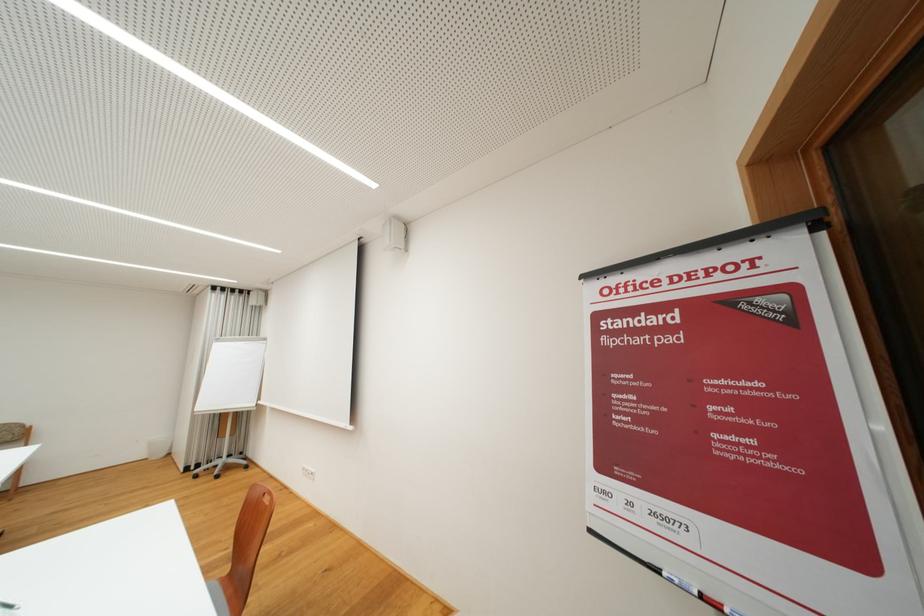
Image resolution: width=924 pixels, height=616 pixels. Describe the element at coordinates (715, 240) in the screenshot. I see `the black flipchart clamp` at that location.